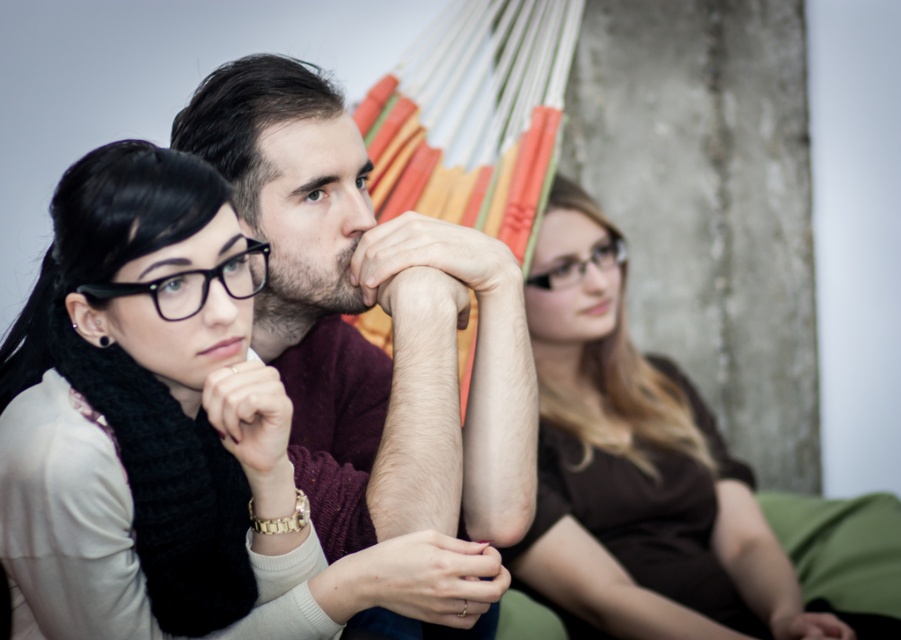
Is matte black scarf at center smaller than black matte glasses at center?

No.

Is matte black scarf at center in front of black matte glasses at center?

Yes.

This screenshot has width=901, height=640. Identify the location of matte black scarf at center. (134, 417).

Who is more forward, [611,413] or [196,282]?

Point [196,282]

Is brown matte shirt at center taller than black matte glasses at center?

Correct, brown matte shirt at center is much taller as black matte glasses at center.

The height and width of the screenshot is (640, 901). Describe the element at coordinates (640, 492) in the screenshot. I see `brown matte shirt at center` at that location.

This screenshot has width=901, height=640. Find the location of `brown matte shirt at center`. brown matte shirt at center is located at coordinates (640, 492).

Is point (451, 634) positioned after point (540, 273)?

No, (451, 634) is in front of (540, 273).

This screenshot has height=640, width=901. I want to click on maroon sweater at center, so click(x=372, y=301).